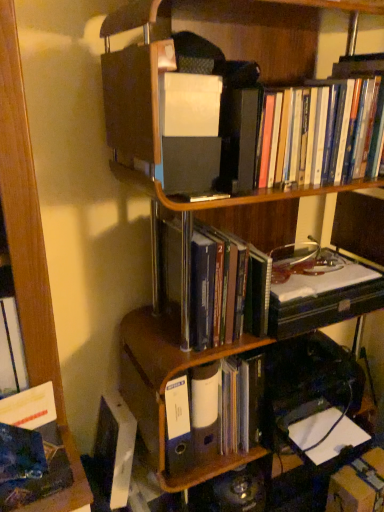
What do you see at coordinates (358, 485) in the screenshot? I see `cardboard box at lower right` at bounding box center [358, 485].

The image size is (384, 512). What do you see at coordinates (219, 415) in the screenshot?
I see `matte plastic binder at center, placed as the third book when sorted from top to bottom` at bounding box center [219, 415].

Measure the distance between point (242, 139) and camera.

Point (242, 139) and camera are 35.04 inches apart.

You are a GUI agent. You are given a task and a screenshot of the screen. Output one action in this format:
    pyautogui.click(x=<x>, y=<y>)
    Task: Click on the blue plastic ring binder at center
    Image resolution: width=384 pixels, height=512 pixels.
    Given the screenshot: What is the action you would take?
    pyautogui.click(x=165, y=394)

Would you say hardcover books at center, which ranks as the 2th book in top-to-bottom order, is part of hardcover books at upper right, which appears as the first book when viewed from the top,'s contents?

That's incorrect, hardcover books at center, which ranks as the 2th book in top-to-bottom order, is not inside hardcover books at upper right, which appears as the first book when viewed from the top.

From the image's perspective, between hardcover books at upper right, the third book from the bottom, and hardcover books at center, acting as the 2th book starting from the bottom, who is located below?

hardcover books at center, acting as the 2th book starting from the bottom, from the image's perspective.

Looking at their sizes, would you say hardcover books at upper right, which appears as the first book when viewed from the top, is wider or thinner than hardcover books at center, acting as the 2th book starting from the bottom?

Clearly, hardcover books at upper right, which appears as the first book when viewed from the top, has less width compared to hardcover books at center, acting as the 2th book starting from the bottom.

I want to click on book that appears in front of the hardcover books at center, which ranks as the 2th book in top-to-bottom order, so click(x=309, y=130).

How far apart are cardboard box at lower right and blue plastic ring binder at center?

56.29 centimeters.

Is blue plastic ring binder at center a part of cardboard box at lower right?

Actually, blue plastic ring binder at center is outside cardboard box at lower right.

From their relative heights in the image, would you say cardboard box at lower right is taller or shorter than blue plastic ring binder at center?

Considering their sizes, cardboard box at lower right has less height than blue plastic ring binder at center.

Which of these two, cardboard box at lower right or blue plastic ring binder at center, is thinner?

With smaller width is cardboard box at lower right.

Considering the relative positions of blue plastic ring binder at center and matte plastic binder at center, placed as the third book when sorted from top to bottom, in the image provided, is blue plastic ring binder at center to the left of matte plastic binder at center, placed as the third book when sorted from top to bottom, from the viewer's perspective?

Yes.

I want to click on shelf lying on the left of matte plastic binder at center, placed as the third book when sorted from top to bottom, so click(x=165, y=394).

Is blue plastic ring binder at center facing away from matte plastic binder at center, placed as the third book when sorted from top to bottom?

That's not correct — blue plastic ring binder at center is not looking away from matte plastic binder at center, placed as the third book when sorted from top to bottom.

How distant is blue plastic ring binder at center from matte plastic binder at center, the first book when ordered from bottom to top?

3.27 inches.

Based on the photo, considering the sizes of matte plastic binder at center, the first book when ordered from bottom to top, and hardcover books at upper right, which appears as the first book when viewed from the top, in the image, is matte plastic binder at center, the first book when ordered from bottom to top, wider or thinner than hardcover books at upper right, which appears as the first book when viewed from the top,?

matte plastic binder at center, the first book when ordered from bottom to top, is thinner than hardcover books at upper right, which appears as the first book when viewed from the top.

Can you confirm if matte plastic binder at center, the first book when ordered from bottom to top, is positioned to the right of hardcover books at upper right, which appears as the first book when viewed from the top?

No, matte plastic binder at center, the first book when ordered from bottom to top, is not to the right of hardcover books at upper right, which appears as the first book when viewed from the top.

How distant is matte plastic binder at center, the first book when ordered from bottom to top, from hardcover books at upper right, the third book from the bottom?

matte plastic binder at center, the first book when ordered from bottom to top, and hardcover books at upper right, the third book from the bottom, are 23.82 inches apart from each other.

Are matte plastic binder at center, the first book when ordered from bottom to top, and hardcover books at upper right, which appears as the first book when viewed from the top, far apart?

No, matte plastic binder at center, the first book when ordered from bottom to top, is in close proximity to hardcover books at upper right, which appears as the first book when viewed from the top.

In order to click on the 1st book above the blue plastic ring binder at center (from the image's perspective) in this screenshot , I will do `click(219, 415)`.

Which of these two, matte plastic binder at center, placed as the third book when sorted from top to bottom, or blue plastic ring binder at center, is smaller?

matte plastic binder at center, placed as the third book when sorted from top to bottom, is smaller.

Is point (212, 449) behind point (140, 314)?

No.

In the scene shown: Is the surface of matte plastic binder at center, the first book when ordered from bottom to top, in direct contact with blue plastic ring binder at center?

Yes, matte plastic binder at center, the first book when ordered from bottom to top, is in contact with blue plastic ring binder at center.

Is blue plastic ring binder at center inside or outside of hardcover books at center, which ranks as the 2th book in top-to-bottom order?

blue plastic ring binder at center is not inside hardcover books at center, which ranks as the 2th book in top-to-bottom order, it's outside.

Is blue plastic ring binder at center facing away from hardcover books at center, which ranks as the 2th book in top-to-bottom order?

That's not correct — blue plastic ring binder at center is not looking away from hardcover books at center, which ranks as the 2th book in top-to-bottom order.

From the image's perspective, would you say blue plastic ring binder at center is positioned over hardcover books at center, which ranks as the 2th book in top-to-bottom order?

No, from the image's perspective, blue plastic ring binder at center is not above hardcover books at center, which ranks as the 2th book in top-to-bottom order.

Is point (126, 390) farther from camera compared to point (222, 301)?

Yes, point (126, 390) is farther from viewer.

Choose the correct answer: Is hardcover books at upper right, the third book from the bottom, inside blue plastic ring binder at center or outside it?

hardcover books at upper right, the third book from the bottom, is not enclosed by blue plastic ring binder at center.

Locate an element on the screen. This screenshot has height=512, width=384. shelf behind the hardcover books at upper right, the third book from the bottom is located at coordinates (165, 394).

This screenshot has width=384, height=512. In order to click on book that is above the hardcover books at center, which ranks as the 2th book in top-to-bottom order (from the image's perspective) in this screenshot , I will do `click(309, 130)`.

You are a GUI agent. You are given a task and a screenshot of the screen. Output one action in this format:
    pyautogui.click(x=<x>, y=<y>)
    Task: Click on the cardboard box below the blue plastic ring binder at center (from the image's perspective)
    The height and width of the screenshot is (512, 384).
    Given the screenshot: What is the action you would take?
    pyautogui.click(x=358, y=485)

When comparing their distances from hardcover books at upper right, which appears as the first book when viewed from the top, does hardcover books at center, acting as the 2th book starting from the bottom, or cardboard box at lower right seem further?

Among the two, cardboard box at lower right is located further to hardcover books at upper right, which appears as the first book when viewed from the top.

Based on the photo, when comparing their distances from hardcover books at center, which ranks as the 2th book in top-to-bottom order, does matte plastic binder at center, the first book when ordered from bottom to top, or cardboard box at lower right seem further?

The object further to hardcover books at center, which ranks as the 2th book in top-to-bottom order, is cardboard box at lower right.

Estimate the real-world distances between objects in this image. Which object is closer to blue plastic ring binder at center, hardcover books at center, which ranks as the 2th book in top-to-bottom order, or hardcover books at upper right, which appears as the first book when viewed from the top?

The object closer to blue plastic ring binder at center is hardcover books at center, which ranks as the 2th book in top-to-bottom order.

Based on their spatial positions, is matte plastic binder at center, placed as the third book when sorted from top to bottom, or hardcover books at center, which ranks as the 2th book in top-to-bottom order, closer to cardboard box at lower right?

matte plastic binder at center, placed as the third book when sorted from top to bottom.

Consider the image. Considering their positions, is cardboard box at lower right positioned further to matte plastic binder at center, the first book when ordered from bottom to top, than hardcover books at upper right, which appears as the first book when viewed from the top?

hardcover books at upper right, which appears as the first book when viewed from the top, is positioned further to the anchor matte plastic binder at center, the first book when ordered from bottom to top.

Considering their positions, is cardboard box at lower right positioned closer to matte plastic binder at center, the first book when ordered from bottom to top, than blue plastic ring binder at center?

Among the two, blue plastic ring binder at center is located nearer to matte plastic binder at center, the first book when ordered from bottom to top.

Estimate the real-world distances between objects in this image. Which object is closer to matte plastic binder at center, placed as the third book when sorted from top to bottom, blue plastic ring binder at center or cardboard box at lower right?

Among the two, blue plastic ring binder at center is located nearer to matte plastic binder at center, placed as the third book when sorted from top to bottom.

Based on their spatial positions, is hardcover books at upper right, the third book from the bottom, or cardboard box at lower right further from hardcover books at center, which ranks as the 2th book in top-to-bottom order?

The object further to hardcover books at center, which ranks as the 2th book in top-to-bottom order, is cardboard box at lower right.

Where is `book that lies between hardcover books at upper right, the third book from the bottom, and matte plastic binder at center, placed as the third book when sorted from top to bottom, from top to bottom`? book that lies between hardcover books at upper right, the third book from the bottom, and matte plastic binder at center, placed as the third book when sorted from top to bottom, from top to bottom is located at coordinates (225, 288).

The height and width of the screenshot is (512, 384). I want to click on shelf between hardcover books at upper right, which appears as the first book when viewed from the top, and cardboard box at lower right vertically, so click(165, 394).

Locate an element on the screen. Image resolution: width=384 pixels, height=512 pixels. book between hardcover books at center, acting as the 2th book starting from the bottom, and blue plastic ring binder at center from top to bottom is located at coordinates (219, 415).

The image size is (384, 512). I want to click on shelf between hardcover books at center, acting as the 2th book starting from the bottom, and cardboard box at lower right from top to bottom, so click(165, 394).